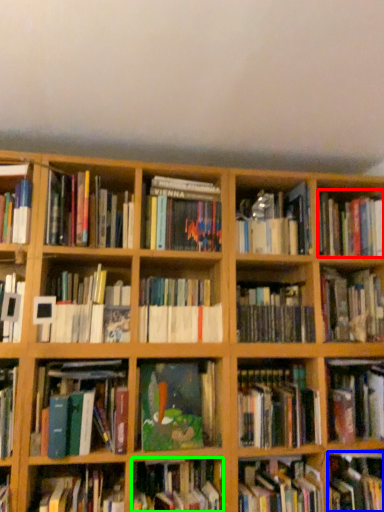
Question: Which is farther away from book (highlighted by a red box)? book (highlighted by a blue box) or book (highlighted by a green box)?

Choices:
 (A) book
 (B) book

Answer: (B)